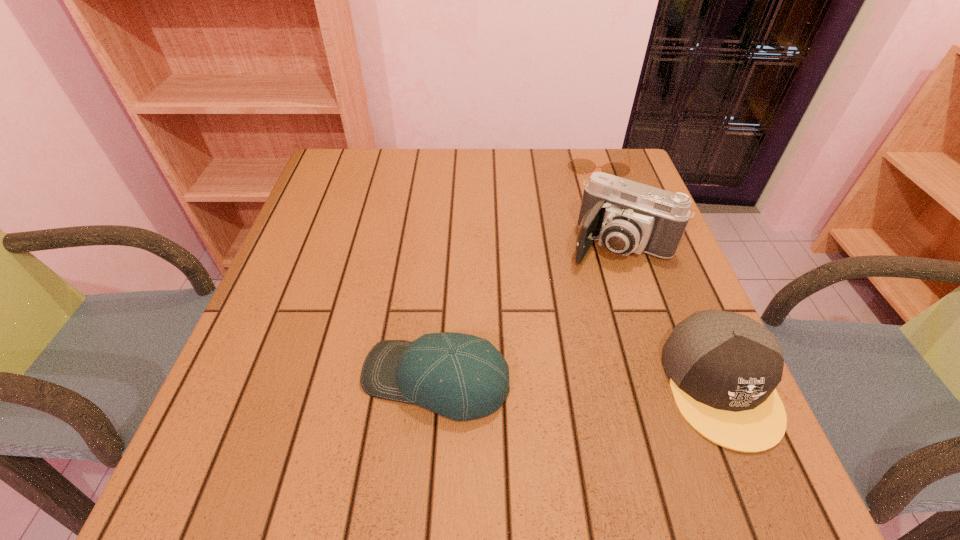
Locate an element on the screen. The image size is (960, 540). object at the near right corner is located at coordinates (723, 367).

Identify the location of free spot at the far edge of the desktop. (562, 161).

The height and width of the screenshot is (540, 960). In order to click on vacant space at the near edge in this screenshot , I will do (356, 387).

I want to click on vacant area at the left edge of the desktop, so click(299, 262).

This screenshot has width=960, height=540. Identify the location of vacant space at the right edge of the desktop. (657, 300).

Locate an element on the screen. This screenshot has width=960, height=540. free space between the leftmost object and the shortest object is located at coordinates (516, 272).

Find the location of `vacant area that lies between the leftmost object and the second farthest object`. vacant area that lies between the leftmost object and the second farthest object is located at coordinates (528, 312).

Image resolution: width=960 pixels, height=540 pixels. Find the location of `unoccupied position between the leftmost object and the cap`. unoccupied position between the leftmost object and the cap is located at coordinates (578, 382).

Identify the location of empty location between the cap and the second farthest object. (670, 314).

This screenshot has height=540, width=960. What are the coordinates of `free point between the cap and the tallest object` in the screenshot? It's located at (670, 314).